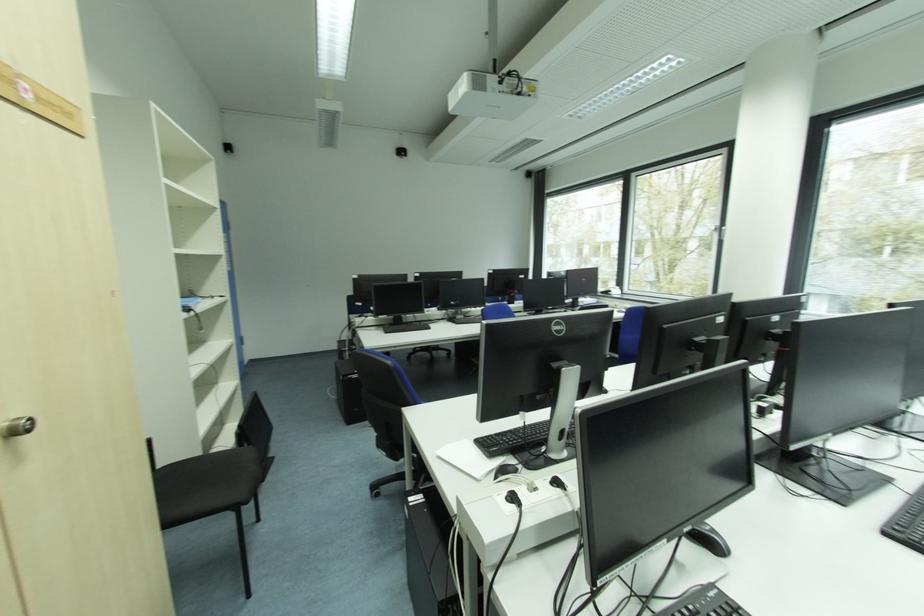
Identify the location of metal door handle. (17, 426).